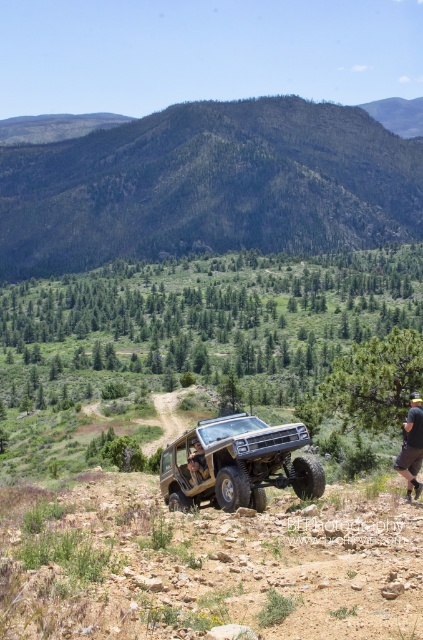
Is green textured mountain at upper center further to camera compared to brown leather jacket at center?

That is True.

Image resolution: width=423 pixels, height=640 pixels. What are the coordinates of `green textured mountain at upper center` in the screenshot? It's located at (209, 186).

Locate an element on the screen. This screenshot has height=640, width=423. green textured mountain at upper center is located at coordinates (209, 186).

Identify the location of khaki shorts at lower right. (412, 445).

Who is higher up, khaki shorts at lower right or brown leather jacket at center?

khaki shorts at lower right

Where is `khaki shorts at lower right`? Image resolution: width=423 pixels, height=640 pixels. khaki shorts at lower right is located at coordinates (412, 445).

Locate an element on the screen. Image resolution: width=423 pixels, height=640 pixels. khaki shorts at lower right is located at coordinates (412, 445).

Who is positioned more to the left, matte khaki jeep at center or brown leather jacket at center?

brown leather jacket at center is more to the left.

The height and width of the screenshot is (640, 423). I want to click on matte khaki jeep at center, so click(236, 464).

Identify the location of matte khaki jeep at center. This screenshot has height=640, width=423. (236, 464).